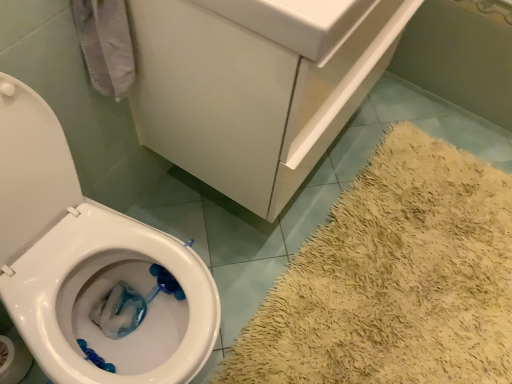
Question: Is white glossy sink at upper center located within white paper at lower left?

Choices:
 (A) no
 (B) yes

Answer: (A)

Question: Is white paper at lower left bigger than white glossy sink at upper center?

Choices:
 (A) no
 (B) yes

Answer: (B)

Question: Does white paper at lower left have a lesser width compared to white glossy sink at upper center?

Choices:
 (A) yes
 (B) no

Answer: (A)

Question: Is white paper at lower left behind white glossy sink at upper center?

Choices:
 (A) yes
 (B) no

Answer: (A)

Question: Is white paper at lower left positioned with its back to white glossy sink at upper center?

Choices:
 (A) yes
 (B) no

Answer: (B)

Question: Does white paper at lower left have a lesser height compared to white glossy sink at upper center?

Choices:
 (A) yes
 (B) no

Answer: (B)

Question: Is white glossy sink at upper center shorter than white glossy bathtub at lower right?

Choices:
 (A) yes
 (B) no

Answer: (A)

Question: Are white glossy sink at upper center and white glossy bathtub at lower right making contact?

Choices:
 (A) no
 (B) yes

Answer: (A)

Question: From the image's perspective, is white glossy sink at upper center below white glossy bathtub at lower right?

Choices:
 (A) no
 (B) yes

Answer: (B)

Question: Does white glossy sink at upper center have a smaller size compared to white glossy bathtub at lower right?

Choices:
 (A) no
 (B) yes

Answer: (B)

Question: Is white glossy sink at upper center taller than white glossy bathtub at lower right?

Choices:
 (A) no
 (B) yes

Answer: (A)

Question: Does white glossy sink at upper center have a lesser width compared to white glossy bathtub at lower right?

Choices:
 (A) yes
 (B) no

Answer: (A)

Question: From the image's perspective, is white glossy bathtub at lower right above white paper at lower left?

Choices:
 (A) no
 (B) yes

Answer: (B)